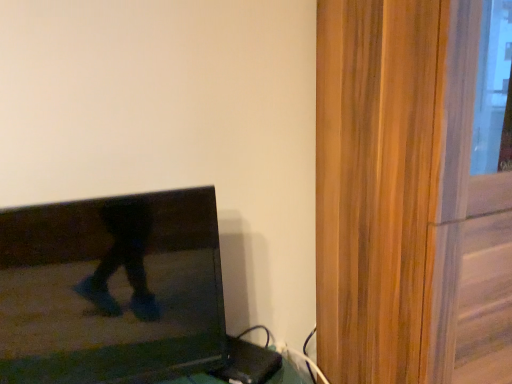
In order to face matte black tv at left, should I rotate leftwards or rightwards?

You should rotate left by 18.532 degrees.

The height and width of the screenshot is (384, 512). What do you see at coordinates (111, 293) in the screenshot?
I see `matte black tv at left` at bounding box center [111, 293].

I want to click on matte black tv at left, so click(111, 293).

Locate an element on the screen. The image size is (512, 384). wooden screen door at right is located at coordinates (414, 191).

This screenshot has width=512, height=384. What do you see at coordinates (414, 191) in the screenshot? I see `wooden screen door at right` at bounding box center [414, 191].

This screenshot has width=512, height=384. In order to click on matte black tv at left in this screenshot , I will do `click(111, 293)`.

Can you confirm if wooden screen door at right is positioned to the left of matte black tv at left?

No, wooden screen door at right is not to the left of matte black tv at left.

Is wooden screen door at right behind matte black tv at left?

No, wooden screen door at right is closer to the viewer.

Which point is more distant from viewer, (342,303) or (217,322)?

The point (342,303) is farther from the camera.

From the image's perspective, is wooden screen door at right below matte black tv at left?

Incorrect, from the image's perspective, wooden screen door at right is higher than matte black tv at left.

From a real-world perspective, is wooden screen door at right located higher than matte black tv at left?

Yes, from a real-world perspective, wooden screen door at right is on top of matte black tv at left.

In the scene shown: Is wooden screen door at right thinner than matte black tv at left?

No, wooden screen door at right is not thinner than matte black tv at left.

Who is shorter, wooden screen door at right or matte black tv at left?

matte black tv at left is shorter.

Between wooden screen door at right and matte black tv at left, which one has larger size?

wooden screen door at right is bigger.

Is wooden screen door at right not within matte black tv at left?

That's correct, wooden screen door at right is outside of matte black tv at left.

Are wooden screen door at right and matte black tv at left far apart?

Actually, wooden screen door at right and matte black tv at left are a little close together.

Consider the image. Could you tell me if wooden screen door at right is turned towards matte black tv at left?

No, wooden screen door at right is not oriented towards matte black tv at left.

Can you tell me how much wooden screen door at right and matte black tv at left differ in facing direction?

The angle between the facing direction of wooden screen door at right and the facing direction of matte black tv at left is 10.5 degrees.

Find the location of `screen door that is above the matte black tv at left (from a real-world perspective)`. screen door that is above the matte black tv at left (from a real-world perspective) is located at coordinates (414, 191).

Considering the relative positions of matte black tv at left and wooden screen door at right in the image provided, is matte black tv at left to the right of wooden screen door at right from the viewer's perspective?

No.

In the image, is matte black tv at left positioned in front of or behind wooden screen door at right?

In the image, matte black tv at left appears behind wooden screen door at right.

Between point (181, 310) and point (430, 11), which one is positioned behind?

The point (181, 310) is farther.

From the picture: From the image's perspective, is matte black tv at left above or below wooden screen door at right?

Clearly, from the image's perspective, matte black tv at left is below wooden screen door at right.

From a real-world perspective, which is physically above, matte black tv at left or wooden screen door at right?

In real-world perspective, wooden screen door at right is above.

Considering the sizes of matte black tv at left and wooden screen door at right in the image, is matte black tv at left wider or thinner than wooden screen door at right?

matte black tv at left is thinner than wooden screen door at right.

Between matte black tv at left and wooden screen door at right, which one has more height?

With more height is wooden screen door at right.

Looking at the image, does matte black tv at left seem bigger or smaller compared to wooden screen door at right?

Clearly, matte black tv at left is smaller in size than wooden screen door at right.

Does matte black tv at left contain wooden screen door at right?

Definitely not — wooden screen door at right is not inside matte black tv at left.

Is matte black tv at left not close to wooden screen door at right?

matte black tv at left is near wooden screen door at right, not far away.

Does matte black tv at left turn towards wooden screen door at right?

No, matte black tv at left does not turn towards wooden screen door at right.

How different are the orientations of matte black tv at left and wooden screen door at right in degrees?

The facing directions of matte black tv at left and wooden screen door at right are 10.5 degrees apart.

Where is `screen door lying above the matte black tv at left (from the image's perspective)`? The width and height of the screenshot is (512, 384). screen door lying above the matte black tv at left (from the image's perspective) is located at coordinates (414, 191).

This screenshot has height=384, width=512. In order to click on screen door above the matte black tv at left (from a real-world perspective) in this screenshot , I will do `click(414, 191)`.

You are a GUI agent. You are given a task and a screenshot of the screen. Output one action in this format:
    pyautogui.click(x=<x>, y=<y>)
    Task: Click on the screen door that appears above the matte black tv at left (from the image's perspective)
    The height and width of the screenshot is (384, 512).
    Given the screenshot: What is the action you would take?
    pyautogui.click(x=414, y=191)